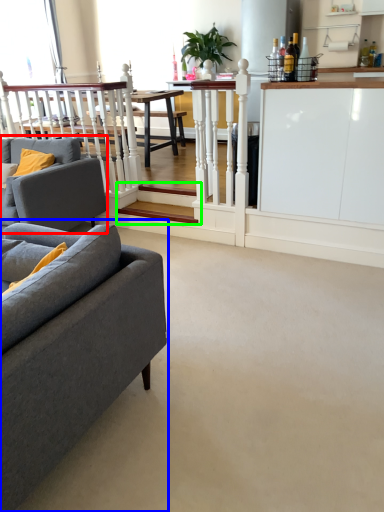
Question: Based on their relative distances, which object is farther from studio couch (highlighted by a red box)? Choose from studio couch (highlighted by a blue box) and stairwell (highlighted by a green box).

Choices:
 (A) studio couch
 (B) stairwell

Answer: (A)